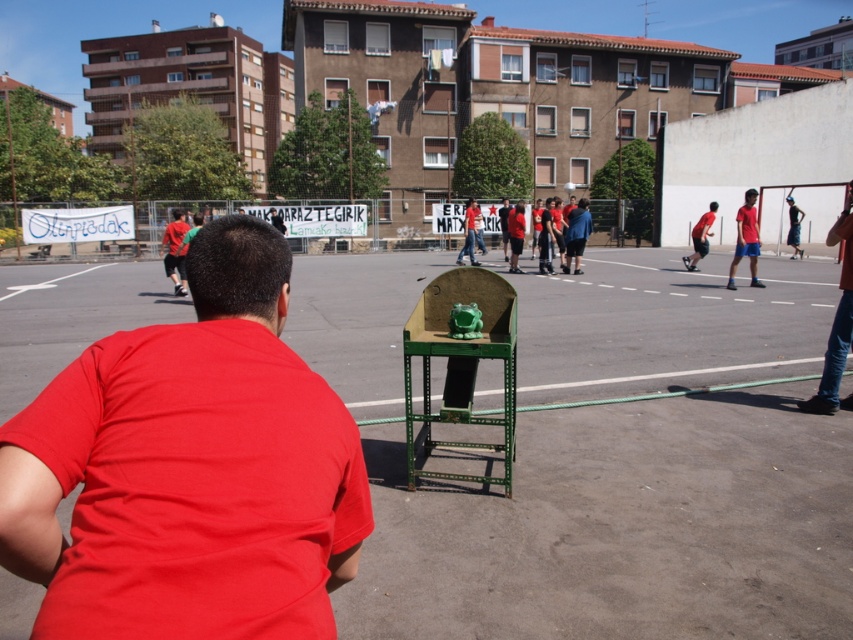
Question: Which of the following is the farthest from the observer?

Choices:
 (A) (692, 253)
 (B) (851, 250)
 (C) (335, 376)

Answer: (A)

Question: Does matte red shorts at right appear over matte red shirt at right?

Choices:
 (A) yes
 (B) no

Answer: (B)

Question: Which of the following is the farthest from the observer?

Choices:
 (A) (682, 257)
 (B) (845, 236)
 (C) (300, 323)

Answer: (A)

Question: Which point is farther to the camera?

Choices:
 (A) (695, 240)
 (B) (798, 250)

Answer: (B)

Question: Can you confirm if matte red shorts at right is bigger than denim shorts at center?

Choices:
 (A) no
 (B) yes

Answer: (B)

Question: Does green matte table at center have a smaller size compared to red matte shirt at center?

Choices:
 (A) no
 (B) yes

Answer: (A)